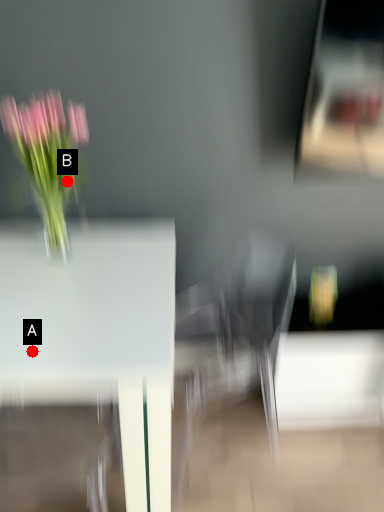
Question: Two points are circled on the image, labeled by A and B beside each circle. Which point is further to the camera?

Choices:
 (A) A is further
 (B) B is further

Answer: (B)